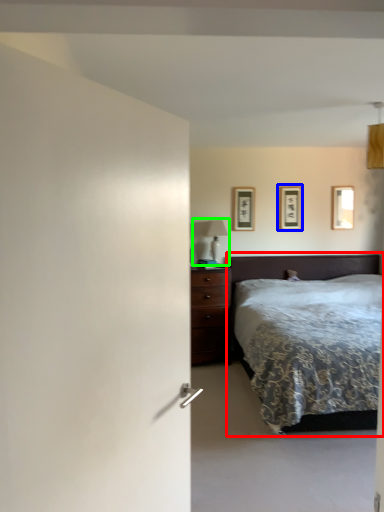
Question: Which is farther away from bed (highlighted by a red box)? picture frame (highlighted by a blue box) or table lamp (highlighted by a green box)?

Choices:
 (A) picture frame
 (B) table lamp

Answer: (B)